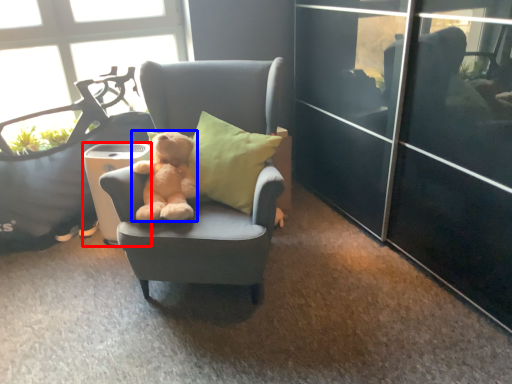
Question: Which of the following is the farthest to the observer, trash bin/can (highlighted by a red box) or teddy bear (highlighted by a blue box)?

Choices:
 (A) trash bin/can
 (B) teddy bear

Answer: (A)